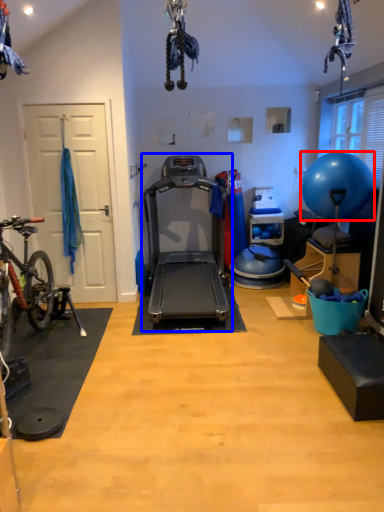
Question: Which of the following is the closest to the observer, ball (highlighted by a red box) or treadmill (highlighted by a blue box)?

Choices:
 (A) ball
 (B) treadmill

Answer: (B)